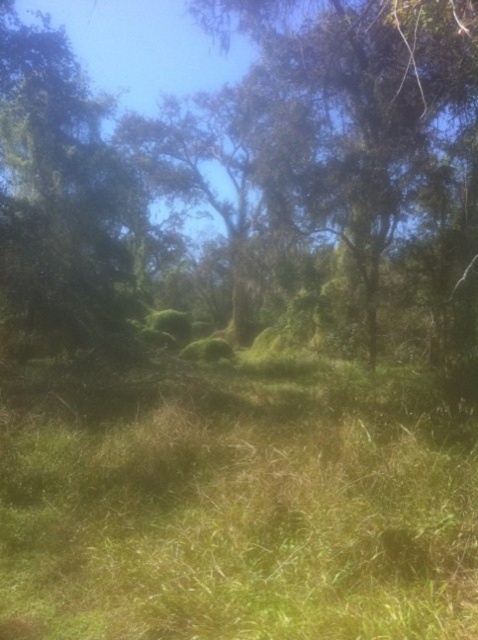
You are standing in the forest and want to place a small marker exactly at the center of the image. Is the green grass at center located to the left or right of where you should place the marker?

The green grass at center is exactly at the center of the image since its coordinates are given as point (236, 502), which would be the center point if the coordinate system is normalized between 0 and 1.

You are a hiker who wants to take a photo of the green mossy tree at center from the green grass at center. Which direction should you move to get a better view of the tree?

You should move to the left of the green mossy tree at center since the green grass at center is located to its right, allowing you to position yourself for a clearer view.

You are a hiker who wants to sit down in the forest. You see the green grass at center and the green mossy tree at center. Which object is closer to the ground?

The green grass at center is located below the green mossy tree at center, so it is closer to the ground.